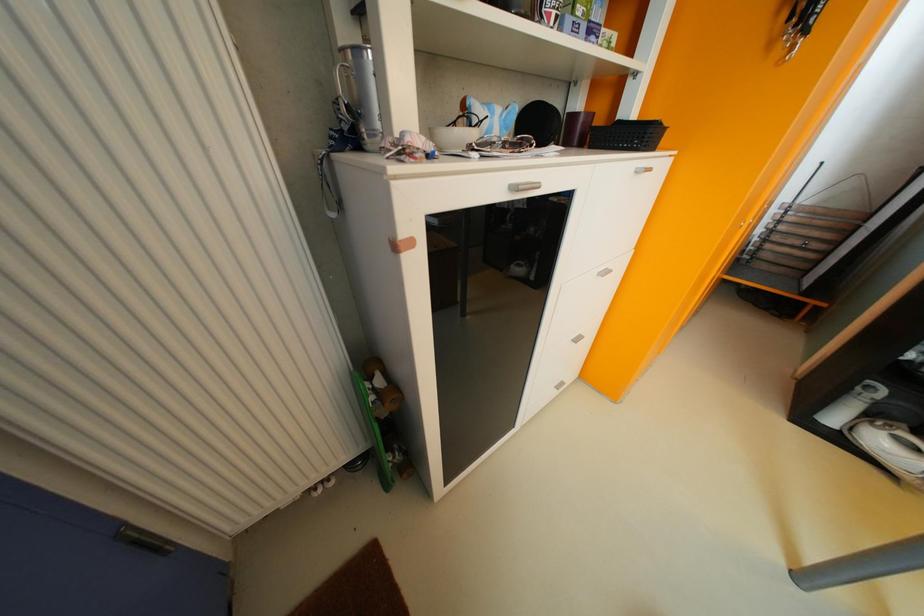
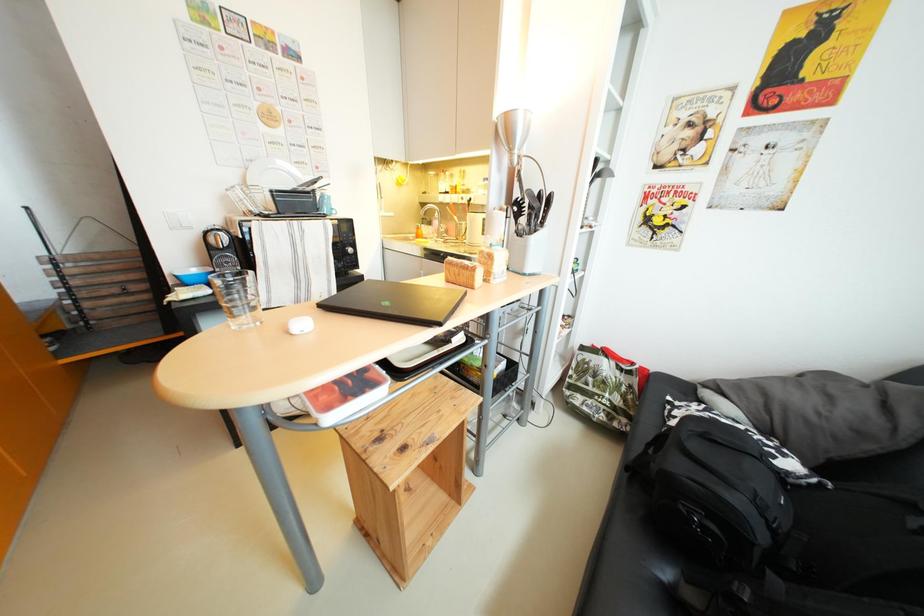
Based on the continuous images, in which direction is the camera rotating?

The camera's rotation is toward right-down.